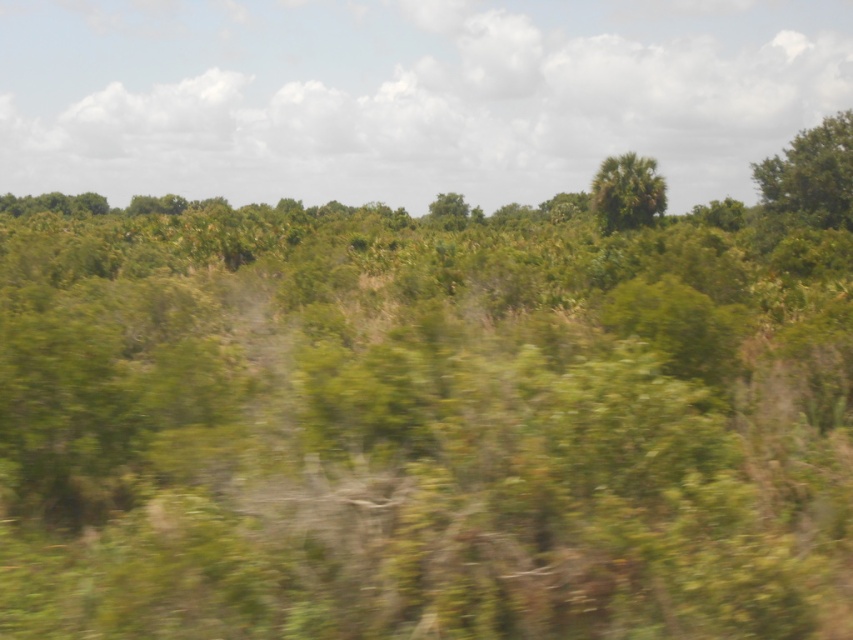
Between point (827, 156) and point (462, 209), which one is positioned in front?

Positioned in front is point (827, 156).

Between green leafy tree at upper right and green leafy tree at center, which one has more height?

With more height is green leafy tree at center.

Where is `green leafy tree at upper right`? green leafy tree at upper right is located at coordinates (811, 173).

Can you confirm if green leafy palm at upper center is taller than green leafy tree at center?

No.

Between green leafy palm at upper center and green leafy tree at center, which one appears on the left side from the viewer's perspective?

From the viewer's perspective, green leafy tree at center appears more on the left side.

Is point (606, 179) in front of point (463, 212)?

That is True.

You are a GUI agent. You are given a task and a screenshot of the screen. Output one action in this format:
    pyautogui.click(x=<x>, y=<y>)
    Task: Click on the green leafy palm at upper center
    The height and width of the screenshot is (640, 853).
    Given the screenshot: What is the action you would take?
    pyautogui.click(x=627, y=192)

Is green leafy tree at upper right shorter than green leafy palm at upper center?

No.

Is green leafy tree at upper right to the left of green leafy palm at upper center from the viewer's perspective?

In fact, green leafy tree at upper right is to the right of green leafy palm at upper center.

The image size is (853, 640). I want to click on green leafy tree at upper right, so click(811, 173).

This screenshot has width=853, height=640. In order to click on green leafy tree at upper right in this screenshot , I will do `click(811, 173)`.